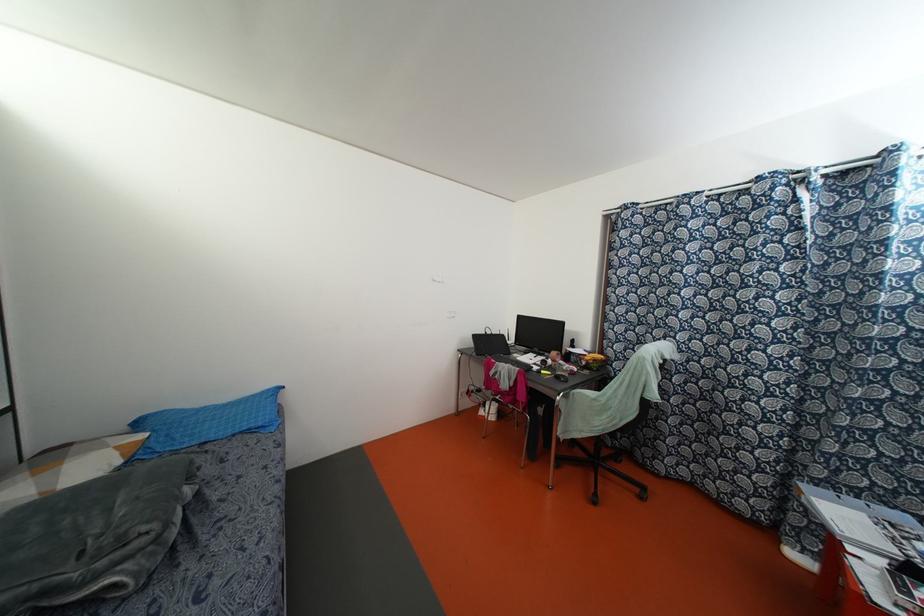
The location [592,358] corresponds to which object?

This point indicates the yellow banana.